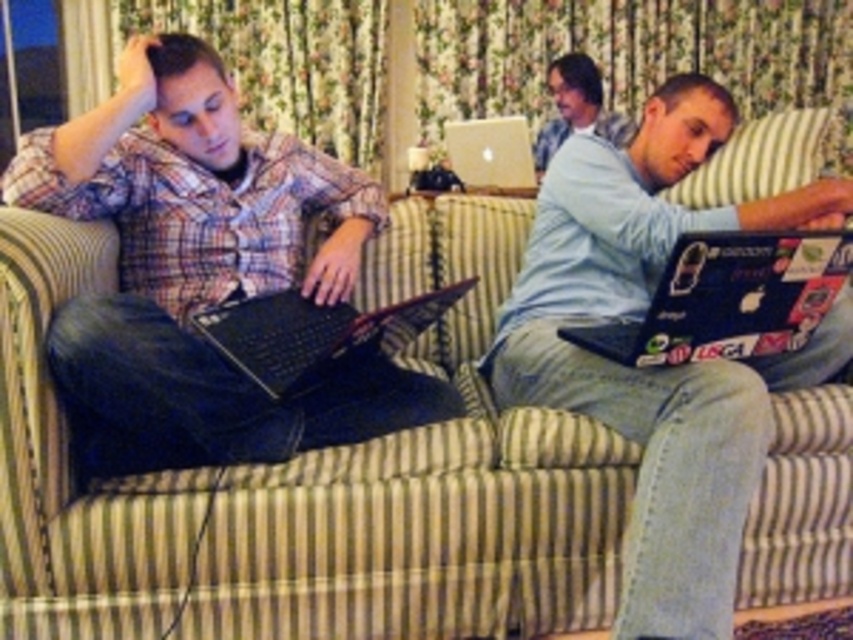
Question: Which point is farther from the camera taking this photo?

Choices:
 (A) (432, 364)
 (B) (515, 186)
 (C) (782, 216)

Answer: (B)

Question: Which point is farther to the camera?

Choices:
 (A) matte gray sweater at center
 (B) silver metallic laptop at center
 (C) sticker-covered laptop at right

Answer: (A)

Question: Is shiny blue laptop at center to the right of matte gray sweater at center from the viewer's perspective?

Choices:
 (A) yes
 (B) no

Answer: (B)

Question: Which point is farther from the camera taking this photo?

Choices:
 (A) (183, 472)
 (B) (534, 184)
 (C) (775, 339)
 (D) (587, 58)

Answer: (D)

Question: Is shiny blue laptop at center closer to the viewer compared to silver metallic laptop at center?

Choices:
 (A) no
 (B) yes

Answer: (B)

Question: Does shiny blue laptop at center appear on the right side of matte gray sweater at center?

Choices:
 (A) yes
 (B) no

Answer: (B)